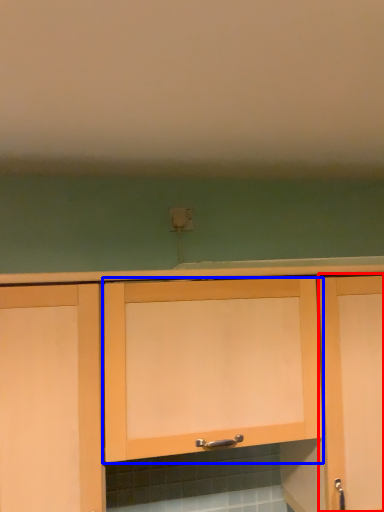
Question: Which point is closer to the camera, cabinetry (highlighted by a red box) or cabinetry (highlighted by a blue box)?

Choices:
 (A) cabinetry
 (B) cabinetry

Answer: (B)